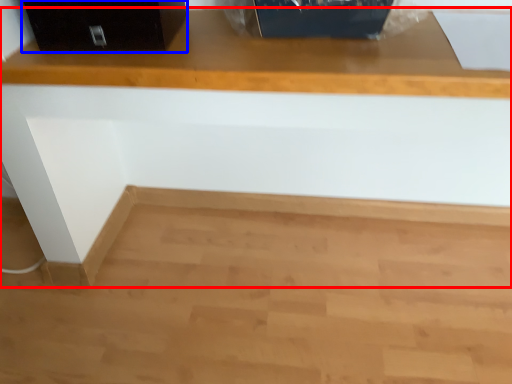
Question: Which of the following is the farthest to the observer, furniture (highlighted by a red box) or file cabinet (highlighted by a blue box)?

Choices:
 (A) furniture
 (B) file cabinet

Answer: (B)